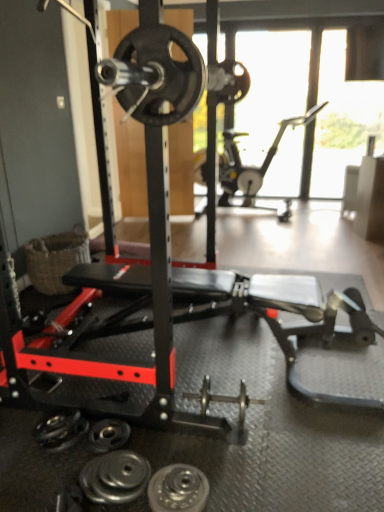
You are a GUI agent. You are given a task and a screenshot of the screen. Output one action in this format:
    pyautogui.click(x=<x>, y=<y>)
    Task: Click on the free point behind polished silver dumbbell at lower left, the 2th dumbbell from the back
    This screenshot has height=512, width=384.
    Given the screenshot: What is the action you would take?
    pyautogui.click(x=150, y=443)